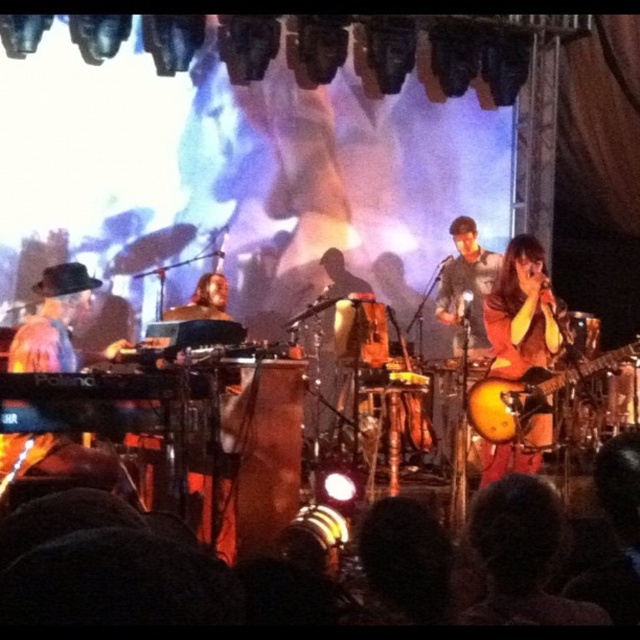
Question: Which object is the closest to the glossy wood guitar at right?

Choices:
 (A) gray fabric shirt at center
 (B) shiny gold guitar at right

Answer: (B)

Question: Considering the real-world distances, which object is closest to the shiny gold guitar at right?

Choices:
 (A) gray fabric shirt at center
 (B) glossy wood guitar at right

Answer: (B)

Question: Is glossy wood guitar at right below gray fabric shirt at center?

Choices:
 (A) no
 (B) yes

Answer: (B)

Question: Is shiny gold guitar at right below gray fabric shirt at center?

Choices:
 (A) no
 (B) yes

Answer: (B)

Question: From the image, what is the correct spatial relationship of glossy wood guitar at right in relation to gray fabric shirt at center?

Choices:
 (A) below
 (B) above

Answer: (A)

Question: Which object appears closest to the camera in this image?

Choices:
 (A) gray fabric shirt at center
 (B) glossy wood guitar at right

Answer: (B)